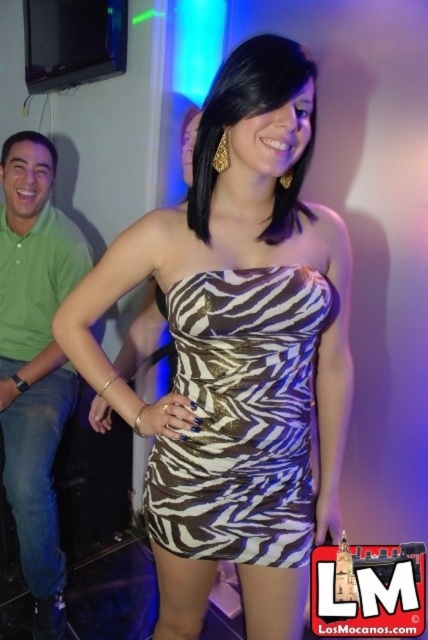
Can you confirm if zebra print dress at center is positioned above zebra print strapless dress at center?

Yes, zebra print dress at center is above zebra print strapless dress at center.

Does zebra print dress at center have a greater width compared to zebra print strapless dress at center?

Yes, zebra print dress at center is wider than zebra print strapless dress at center.

Does point (76, 296) come farther from viewer compared to point (184, 532)?

No, it is in front of (184, 532).

Where is `zebra print dress at center`? The height and width of the screenshot is (640, 428). zebra print dress at center is located at coordinates (237, 349).

Does zebra print strapless dress at center appear under green cotton shirt at left?

No.

Does zebra print strapless dress at center appear over green cotton shirt at left?

Correct, zebra print strapless dress at center is located above green cotton shirt at left.

Who is more forward, (291, 419) or (33, 461)?

Point (291, 419) is more forward.

Locate an element on the screen. This screenshot has height=640, width=428. zebra print strapless dress at center is located at coordinates (240, 419).

Who is more forward, (235,490) or (14,371)?

Point (235,490)

Is point (327, 273) closer to viewer compared to point (36, 211)?

Yes, point (327, 273) is in front of point (36, 211).

Where is `zebra print dress at center`? This screenshot has height=640, width=428. zebra print dress at center is located at coordinates (237, 349).